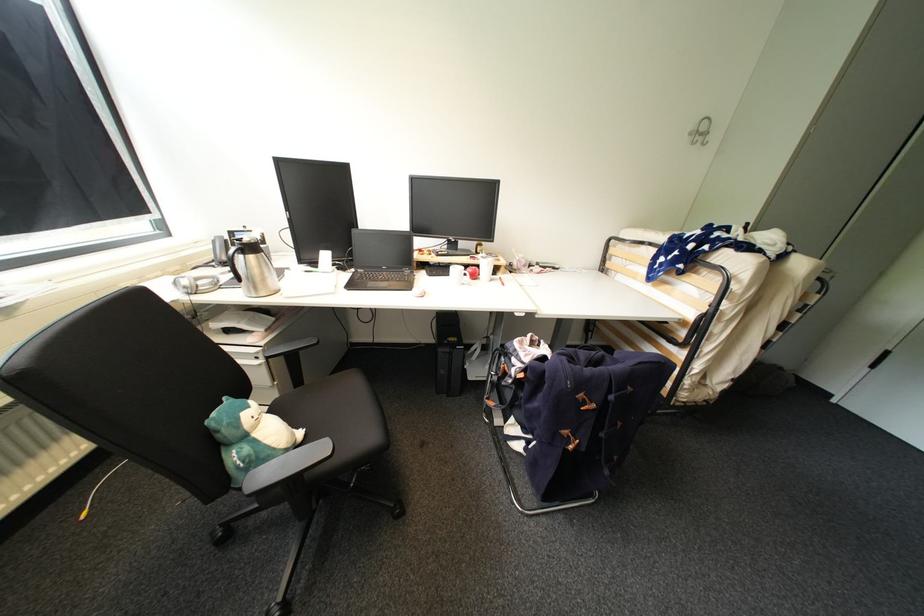
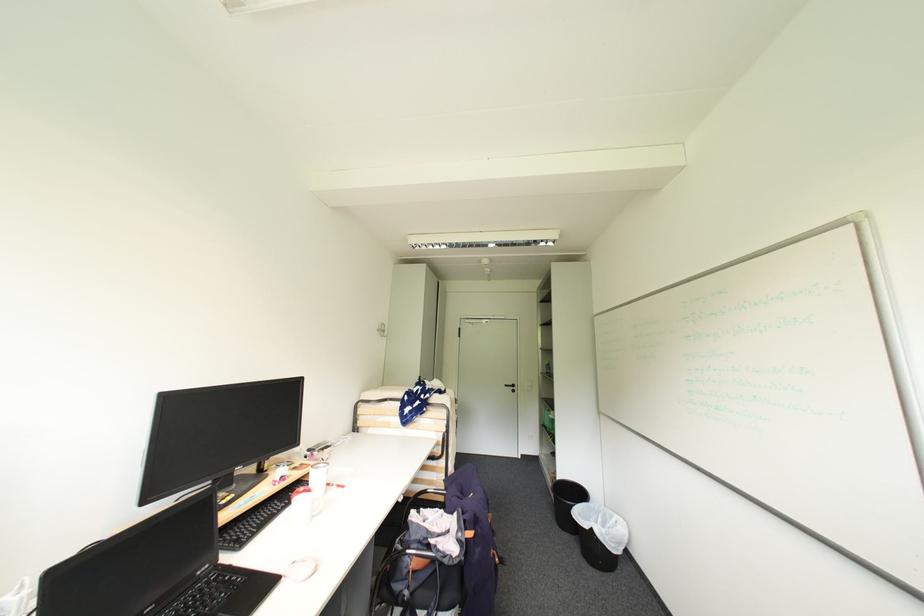
Find the pixel in the second image that matches point (524, 315) in the first image.

(407, 501)